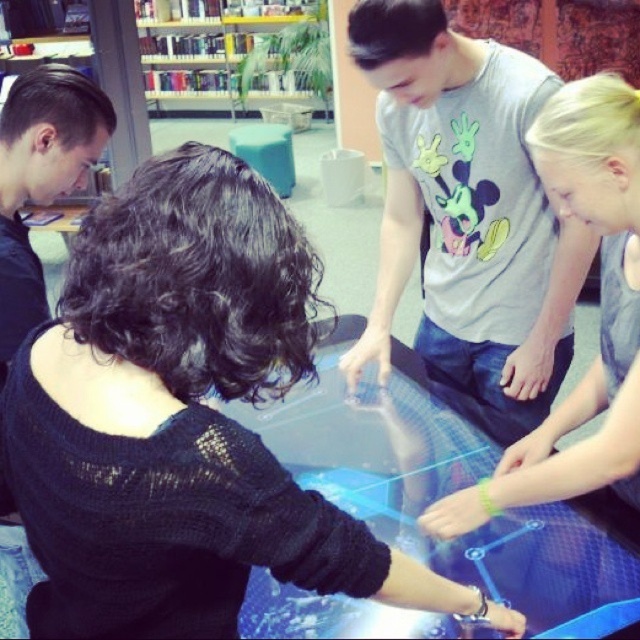
Question: Can you confirm if transparent plastic table at center is positioned to the right of gray fabric shirt at center?

Choices:
 (A) yes
 (B) no

Answer: (B)

Question: Which point appears farthest from the camera in this image?

Choices:
 (A) (531, 577)
 (B) (28, 356)

Answer: (A)

Question: Is black knitted sweater at center wider than gray cotton shirt at center?

Choices:
 (A) no
 (B) yes

Answer: (B)

Question: Which of the following is the closest to the observer?

Choices:
 (A) (477, 180)
 (B) (564, 516)

Answer: (B)

Question: Is gray fabric shirt at center to the right of wooden bookshelf at upper center from the viewer's perspective?

Choices:
 (A) yes
 (B) no

Answer: (A)

Question: Which point is closer to the camera?

Choices:
 (A) gray fabric shirt at center
 (B) gray cotton shirt at center

Answer: (A)